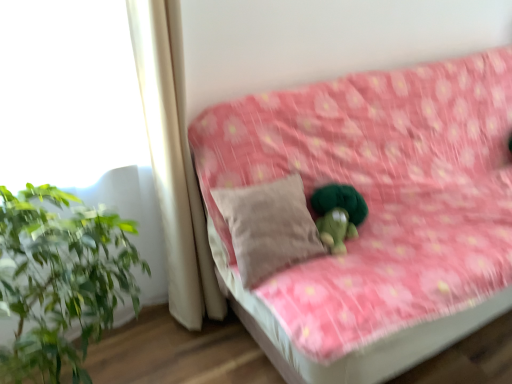
Locate an element on the screen. This screenshot has height=384, width=512. white fabric curtain at left is located at coordinates (173, 161).

Locate an element on the screen. This screenshot has height=384, width=512. white fabric curtain at left is located at coordinates tap(173, 161).

Is point (210, 252) farther from camera compared to point (362, 360)?

That is True.

What's the angular difference between white fabric curtain at left and pink floral fabric couch at center's facing directions?

2.19e-05 degrees separate the facing orientations of white fabric curtain at left and pink floral fabric couch at center.

Which object is positioned more to the left, white fabric curtain at left or pink floral fabric couch at center?

Positioned to the left is white fabric curtain at left.

The image size is (512, 384). In order to click on curtain above the pink floral fabric couch at center (from the image's perspective) in this screenshot , I will do `click(173, 161)`.

From the image's perspective, which is below, pink floral fabric couch at center or beige fabric pillow at center?

From the image's view, beige fabric pillow at center is below.

Is pink floral fabric couch at center touching beige fabric pillow at center?

pink floral fabric couch at center and beige fabric pillow at center are clearly separated.

Which object is positioned more to the left, pink floral fabric couch at center or beige fabric pillow at center?

Positioned to the left is beige fabric pillow at center.

What's the angular difference between beige fabric pillow at center and white fabric curtain at left's facing directions?

2.74e-05 degrees separate the facing orientations of beige fabric pillow at center and white fabric curtain at left.

Considering the positions of objects beige fabric pillow at center and white fabric curtain at left in the image provided, who is more to the right, beige fabric pillow at center or white fabric curtain at left?

beige fabric pillow at center.

Which object is further away from the camera taking this photo, beige fabric pillow at center or white fabric curtain at left?

beige fabric pillow at center is more distant.

Which is behind, point (292, 252) or point (135, 42)?

The point (292, 252) is more distant.

Considering the positions of objects pink floral fabric couch at center and white fabric curtain at left in the image provided, who is more to the right, pink floral fabric couch at center or white fabric curtain at left?

pink floral fabric couch at center is more to the right.

Considering the positions of points (331, 166) and (168, 288), is point (331, 166) farther from camera compared to point (168, 288)?

No, (331, 166) is closer to viewer.

From the image's perspective, is pink floral fabric couch at center on top of white fabric curtain at left?

Actually, pink floral fabric couch at center appears below white fabric curtain at left in the image.

Does pink floral fabric couch at center have a greater width compared to white fabric curtain at left?

Correct, the width of pink floral fabric couch at center exceeds that of white fabric curtain at left.

Can you tell me how much beige fabric pillow at center and pink floral fabric couch at center differ in facing direction?

There is a 1.8e-05-degree angle between the facing directions of beige fabric pillow at center and pink floral fabric couch at center.

Identify the location of studio couch above the beige fabric pillow at center (from the image's perspective). [x=377, y=210].

From the image's perspective, which is above, beige fabric pillow at center or pink floral fabric couch at center?

pink floral fabric couch at center appears higher in the image.

Is beige fabric pillow at center inside or outside of pink floral fabric couch at center?

The correct answer is: inside.

From the image's perspective, is white fabric curtain at left located above or below beige fabric pillow at center?

Based on their image positions, white fabric curtain at left is located above beige fabric pillow at center.

Are white fabric curtain at left and beige fabric pillow at center making contact?

No, white fabric curtain at left is not in contact with beige fabric pillow at center.

Is white fabric curtain at left oriented away from beige fabric pillow at center?

white fabric curtain at left is not turned away from beige fabric pillow at center.

Looking at the image, does white fabric curtain at left seem bigger or smaller compared to beige fabric pillow at center?

Considering their sizes, white fabric curtain at left takes up more space than beige fabric pillow at center.

In the image, there is a white fabric curtain at left. Where is `studio couch below it (from a real-world perspective)`? Image resolution: width=512 pixels, height=384 pixels. studio couch below it (from a real-world perspective) is located at coordinates (377, 210).

This screenshot has width=512, height=384. What are the coordinates of `pillow behind the pink floral fabric couch at center` in the screenshot? It's located at (269, 227).

Looking at the image, which one is located further to beige fabric pillow at center, white fabric curtain at left or pink floral fabric couch at center?

pink floral fabric couch at center is further to beige fabric pillow at center.

Estimate the real-world distances between objects in this image. Which object is closer to white fabric curtain at left, pink floral fabric couch at center or beige fabric pillow at center?

beige fabric pillow at center lies closer to white fabric curtain at left than the other object.

Looking at the image, which one is located further to white fabric curtain at left, beige fabric pillow at center or pink floral fabric couch at center?

pink floral fabric couch at center lies further to white fabric curtain at left than the other object.

Estimate the real-world distances between objects in this image. Which object is closer to pink floral fabric couch at center, white fabric curtain at left or beige fabric pillow at center?

beige fabric pillow at center is positioned closer to the anchor pink floral fabric couch at center.

Looking at this image, based on their spatial positions, is beige fabric pillow at center or white fabric curtain at left closer to pink floral fabric couch at center?

The object closer to pink floral fabric couch at center is beige fabric pillow at center.

Based on their spatial positions, is pink floral fabric couch at center or white fabric curtain at left further from beige fabric pillow at center?

Among the two, pink floral fabric couch at center is located further to beige fabric pillow at center.

At what (x,y) coordinates should I click in order to perform the action: click on pillow between white fabric curtain at left and pink floral fabric couch at center. Please return your answer as a coordinate pair (x, y). The width and height of the screenshot is (512, 384). Looking at the image, I should click on (269, 227).